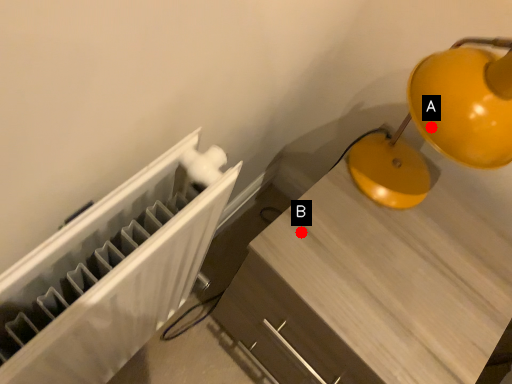
Question: Two points are circled on the image, labeled by A and B beside each circle. Which point appears farthest from the camera in this image?

Choices:
 (A) A is further
 (B) B is further

Answer: (B)